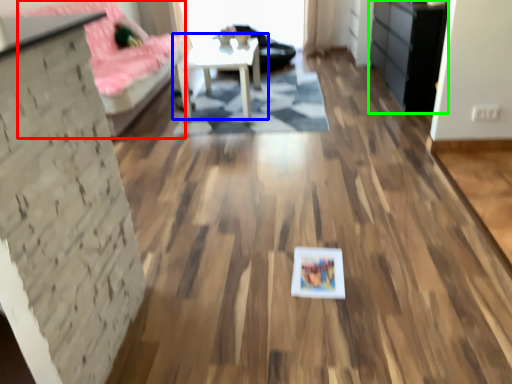
Question: Based on their relative distances, which object is nearer to couch (highlighted by a red box)? Choose from table (highlighted by a blue box) and dresser (highlighted by a green box).

Choices:
 (A) table
 (B) dresser

Answer: (A)